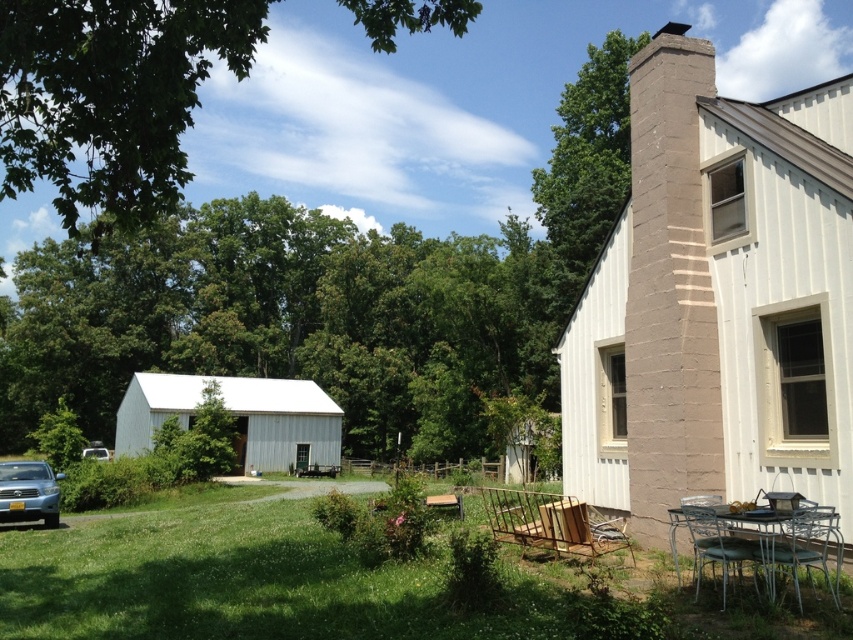
You are standing in front of the house and want to take a photo of both the brown brick chimney at upper right and the white wood barn at lower left. Which object should you position closer to the camera to ensure both are fully visible in the frame?

The brown brick chimney at upper right is located above the white wood barn at lower left, so you should position the camera closer to the white wood barn at lower left to ensure both are fully visible in the frame.

You are standing at the point marked by point (669, 289) in the image. What object is located exactly at that point?

The brown brick chimney at upper right is located exactly at point (669, 289).